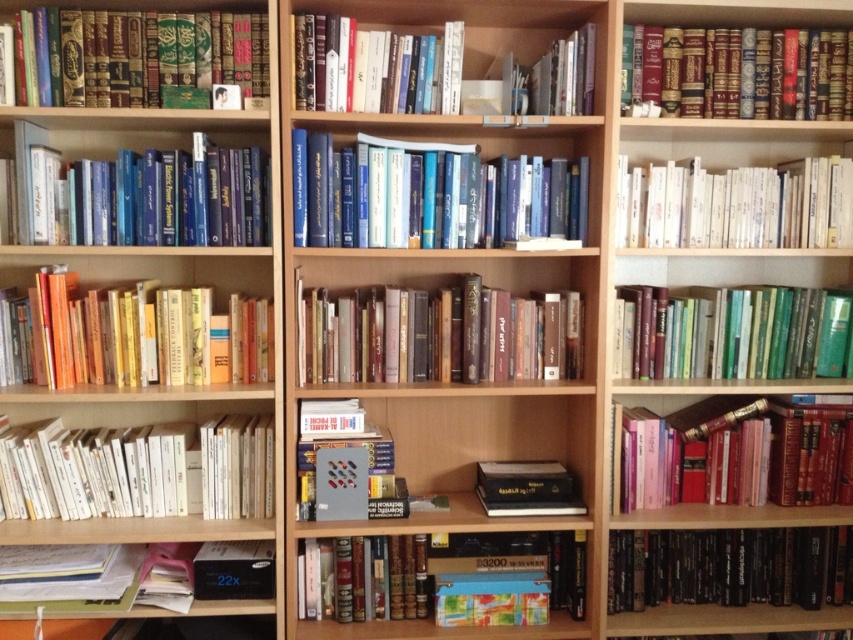
Question: Which object is closer to the camera taking this photo?

Choices:
 (A) pink matte book at lower right
 (B) white paperbacks at lower left

Answer: (B)

Question: Can you confirm if maroon leather book at upper right is bigger than white plastic clock at lower left?

Choices:
 (A) no
 (B) yes

Answer: (A)

Question: Is white paperbacks at lower left smaller than matte black book at upper left?

Choices:
 (A) yes
 (B) no

Answer: (B)

Question: Which object is closer to the camera taking this photo?

Choices:
 (A) black matte book at center
 (B) metallic gray book at center
 (C) white paperbacks at center

Answer: (B)

Question: Is wooden bookshelf at left smaller than blue hardcover books at left?

Choices:
 (A) no
 (B) yes

Answer: (A)

Question: Which point is farther to the camera?

Choices:
 (A) (537, 499)
 (B) (740, 60)
 (C) (527, 536)
 (D) (651, 228)

Answer: (C)